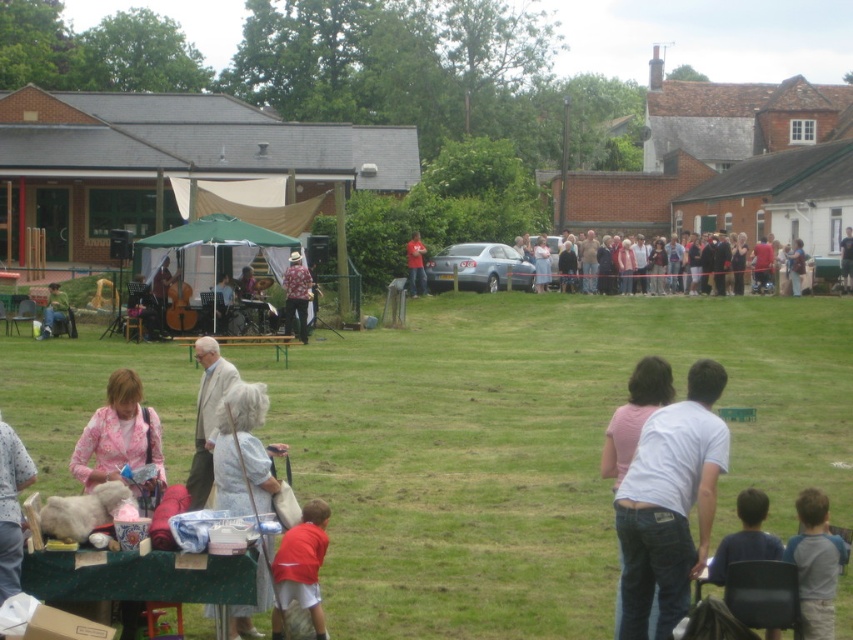
Who is positioned more to the left, light beige fabric coat at center or floral fabric hat at center?

light beige fabric coat at center is more to the left.

Can you confirm if light beige fabric coat at center is positioned to the left of floral fabric hat at center?

Correct, you'll find light beige fabric coat at center to the left of floral fabric hat at center.

Locate an element on the screen. The image size is (853, 640). light beige fabric coat at center is located at coordinates (207, 417).

You are a GUI agent. You are given a task and a screenshot of the screen. Output one action in this format:
    pyautogui.click(x=<x>, y=<y>)
    Task: Click on the light beige fabric coat at center
    
    Given the screenshot: What is the action you would take?
    pyautogui.click(x=207, y=417)

Which is more to the left, fluffy white teddy bear at lower left or matte black jacket at center?

fluffy white teddy bear at lower left

Looking at this image, does fluffy white teddy bear at lower left have a smaller size compared to matte black jacket at center?

Indeed, fluffy white teddy bear at lower left has a smaller size compared to matte black jacket at center.

Between point (20, 460) and point (802, 275), which one is positioned in front?

Point (20, 460) is more forward.

Find the location of a particular element. This screenshot has width=853, height=640. fluffy white teddy bear at lower left is located at coordinates (10, 508).

Is floral fabric hat at center further to camera compared to matte black guitar at center?

No, floral fabric hat at center is in front of matte black guitar at center.

Does floral fabric hat at center appear over matte black guitar at center?

Correct, floral fabric hat at center is located above matte black guitar at center.

Measure the distance between point (293, 285) and camera.

Point (293, 285) and camera are 37.72 meters apart.

Locate an element on the screen. Image resolution: width=853 pixels, height=640 pixels. floral fabric hat at center is located at coordinates (296, 296).